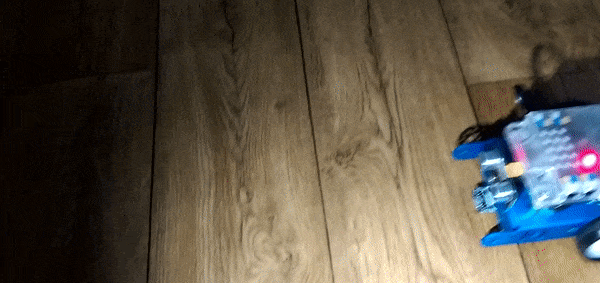
Find the location of `planks`. planks is located at coordinates click(553, 97), click(394, 107), click(278, 114).